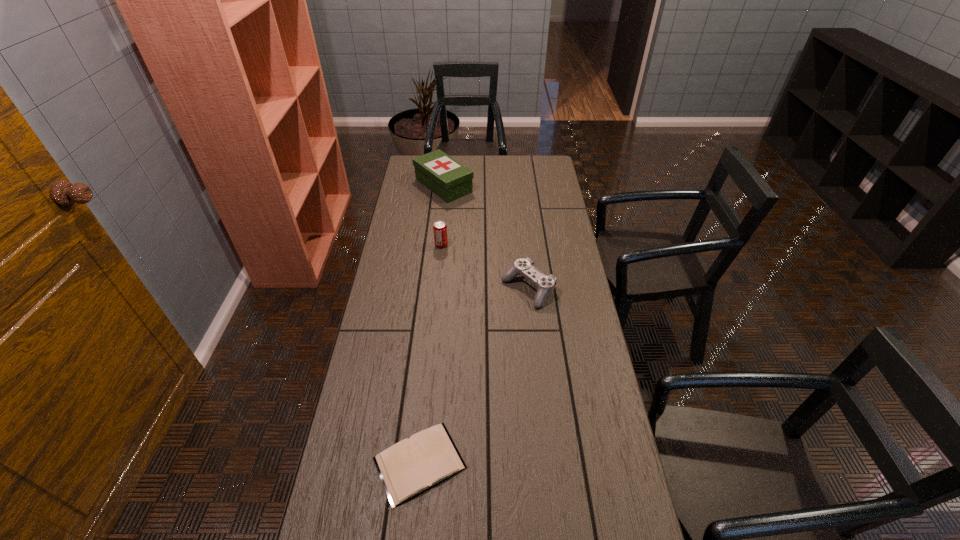
You are a GUI agent. You are given a task and a screenshot of the screen. Output one action in this format:
    pyautogui.click(x=<x>, y=<y>)
    Task: Click on the vacant space that satisfies the following two spatial constraints: 1. on the back side of the rightmost object; 2. on the right side of the hardback book
    Image resolution: width=960 pixels, height=540 pixels.
    Given the screenshot: What is the action you would take?
    pyautogui.click(x=437, y=289)

Locate an element on the screen. This screenshot has height=540, width=960. vacant space that satisfies the following two spatial constraints: 1. on the back side of the nearest object; 2. on the left side of the third tallest object is located at coordinates pyautogui.click(x=437, y=289).

The height and width of the screenshot is (540, 960). Identify the location of vacant region that satisfies the following two spatial constraints: 1. on the front side of the farthest object; 2. on the left side of the shortest object. (414, 463).